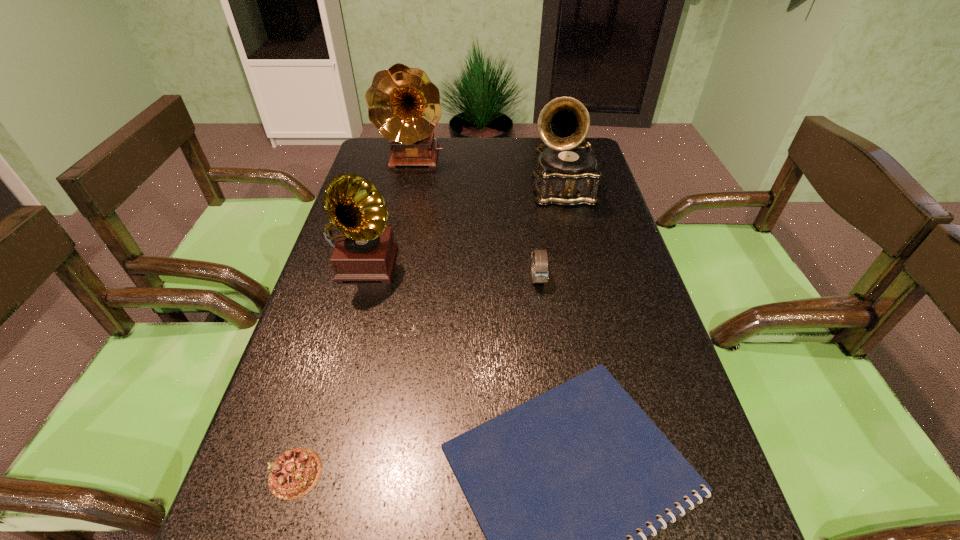
At what (x,y) coordinates should I click in order to perform the action: click on free space between the rightmost phonograph record and the shortest phonograph record. Please return your answer as a coordinate pair (x, y). This screenshot has width=960, height=540. Looking at the image, I should click on (464, 227).

I want to click on empty location between the nearest phonograph record and the rightmost phonograph record, so click(x=464, y=227).

Identify which object is the second closest to the shortest object. Please provide its 2D coordinates. Your answer should be formatted as a tuple, i.e. [(x, y)], where the tuple contains the x and y coordinates of a point satisfying the conditions above.

[(539, 257)]

Locate an element on the screen. This screenshot has height=540, width=960. object that is the closest to the notepad is located at coordinates (295, 473).

Select which phonograph record appears as the second closest to the rightmost phonograph record. Please provide its 2D coordinates. Your answer should be formatted as a tuple, i.e. [(x, y)], where the tuple contains the x and y coordinates of a point satisfying the conditions above.

[(365, 250)]

Locate an element on the screen. phonograph record identified as the closest to the second shortest object is located at coordinates (365, 250).